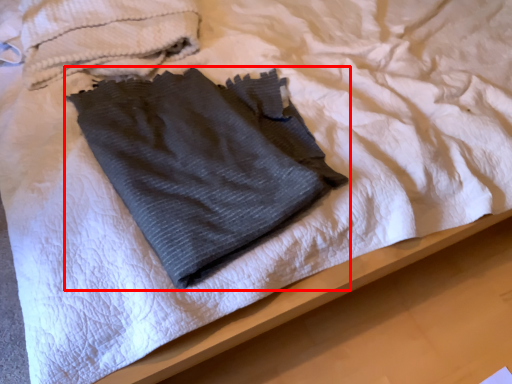
Question: From the image's perspective, what is the correct spatial positioning of towel (annotated by the red box) in reference to towel?

Choices:
 (A) below
 (B) above

Answer: (A)